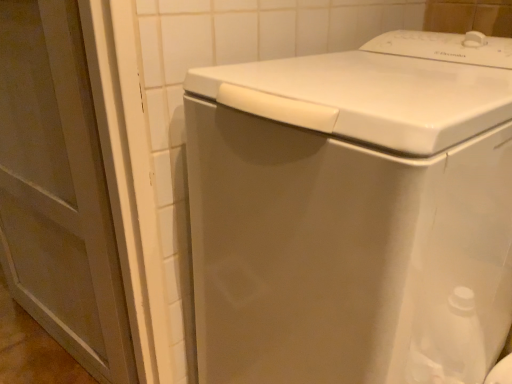
Question: Considering the relative positions of white glossy washing machine at center and matte white screen door at left in the image provided, is white glossy washing machine at center to the left or to the right of matte white screen door at left?

Choices:
 (A) right
 (B) left

Answer: (A)

Question: Considering their positions, is white glossy washing machine at center located in front of or behind matte white screen door at left?

Choices:
 (A) front
 (B) behind

Answer: (A)

Question: From the image's perspective, is white glossy washing machine at center positioned above or below matte white screen door at left?

Choices:
 (A) below
 (B) above

Answer: (A)

Question: Do you think matte white screen door at left is within white glossy washing machine at center, or outside of it?

Choices:
 (A) outside
 (B) inside

Answer: (A)

Question: Would you say matte white screen door at left is to the left or to the right of white glossy washing machine at center in the picture?

Choices:
 (A) right
 (B) left

Answer: (B)

Question: From the image's perspective, is matte white screen door at left located above or below white glossy washing machine at center?

Choices:
 (A) above
 (B) below

Answer: (A)

Question: In terms of height, does matte white screen door at left look taller or shorter compared to white glossy washing machine at center?

Choices:
 (A) tall
 (B) short

Answer: (A)